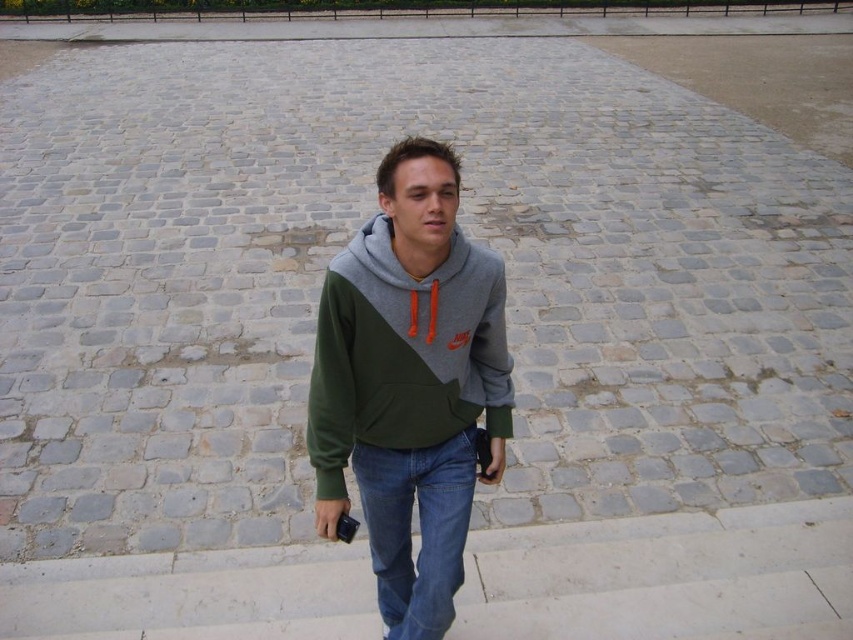
The young man in the image is wearing a green fleece hoodie at center and denim at center. Which clothing item is positioned higher on his body?

The green fleece hoodie at center is positioned higher on his body than the denim at center.

You are a photographer trying to capture a photo of the young man descending the steps. You notice two points marked on your camera screen at coordinates point [317,376] and point [387,588]. Which point is nearer to your camera lens?

Point [317,376] is closer to the camera than point [387,588], so the photographer should focus on that point first as it is nearer to the camera lens.